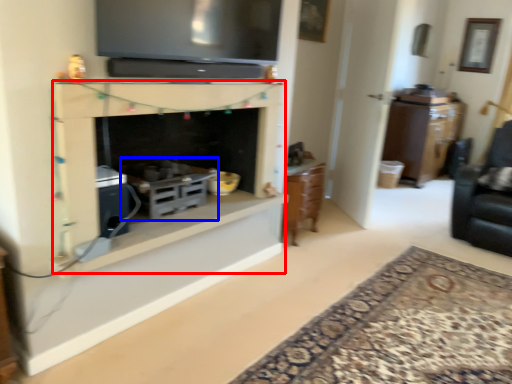
Question: Among these objects, which one is farthest to the camera, fireplace (highlighted by a red box) or appliance (highlighted by a blue box)?

Choices:
 (A) fireplace
 (B) appliance

Answer: (B)